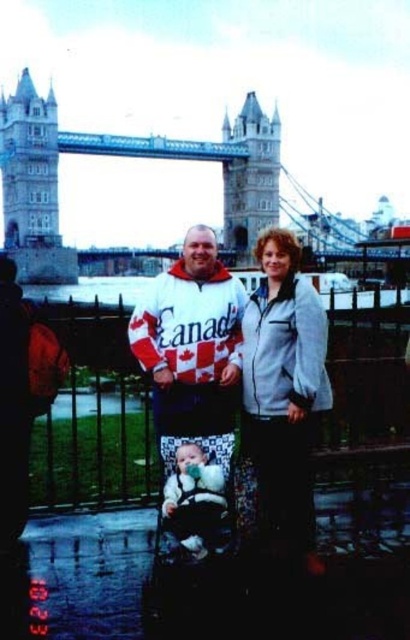
Question: Among these points, which one is farthest from the camera?

Choices:
 (A) (236, 307)
 (B) (191, 536)
 (C) (287, 362)

Answer: (A)

Question: Can you confirm if light gray zip-up jacket at center is thinner than white/red/canadian flag sweater at center?

Choices:
 (A) no
 (B) yes

Answer: (B)

Question: Does light gray zip-up jacket at center have a larger size compared to white/red/canadian flag sweater at center?

Choices:
 (A) no
 (B) yes

Answer: (A)

Question: Which of the following is the closest to the observer?

Choices:
 (A) (221, 310)
 (B) (246, 406)
 (C) (225, 472)

Answer: (C)

Question: Which of the following is the farthest from the observer?

Choices:
 (A) light gray zip-up jacket at center
 (B) white fleece jacket at center

Answer: (B)

Question: Is the position of white fleece jacket at center less distant than that of white/red/canadian flag sweater at center?

Choices:
 (A) no
 (B) yes

Answer: (B)